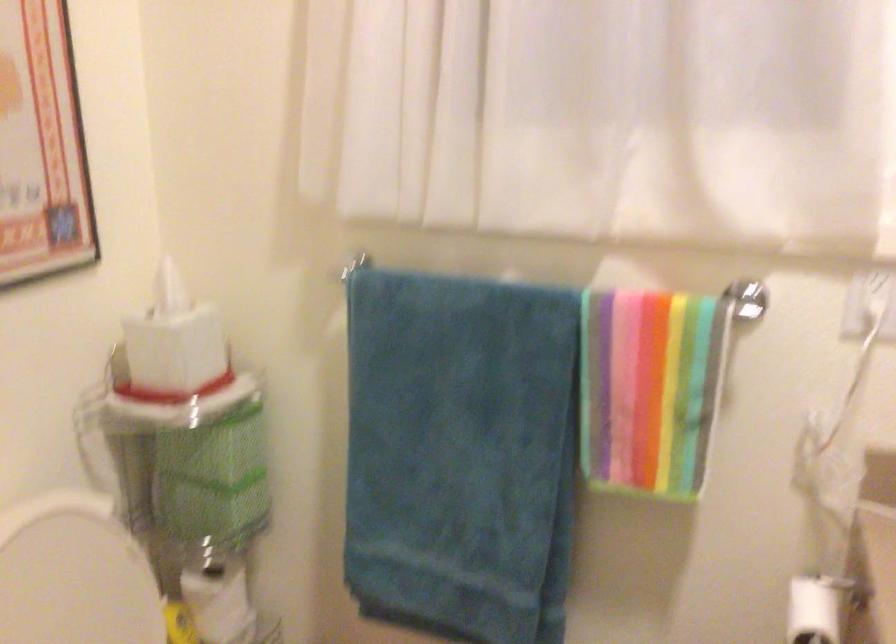
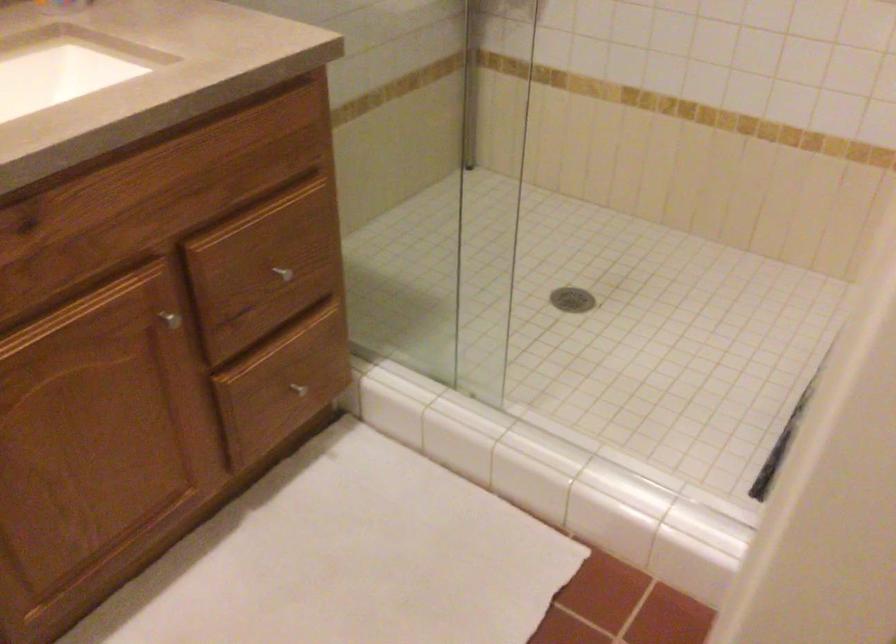
First-person continuous shooting, in which direction is the camera rotating?

The camera's rotation is toward right-down.